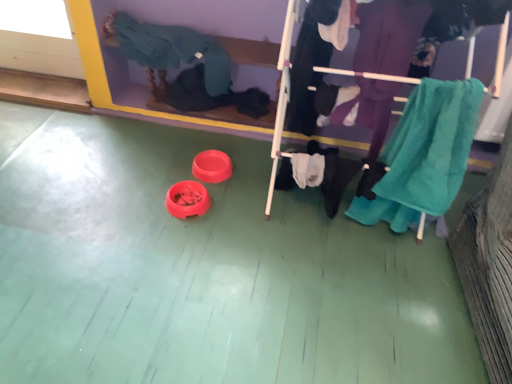
This screenshot has width=512, height=384. Find the location of `free space in front of teal fabric clothes rack at center`. free space in front of teal fabric clothes rack at center is located at coordinates (350, 302).